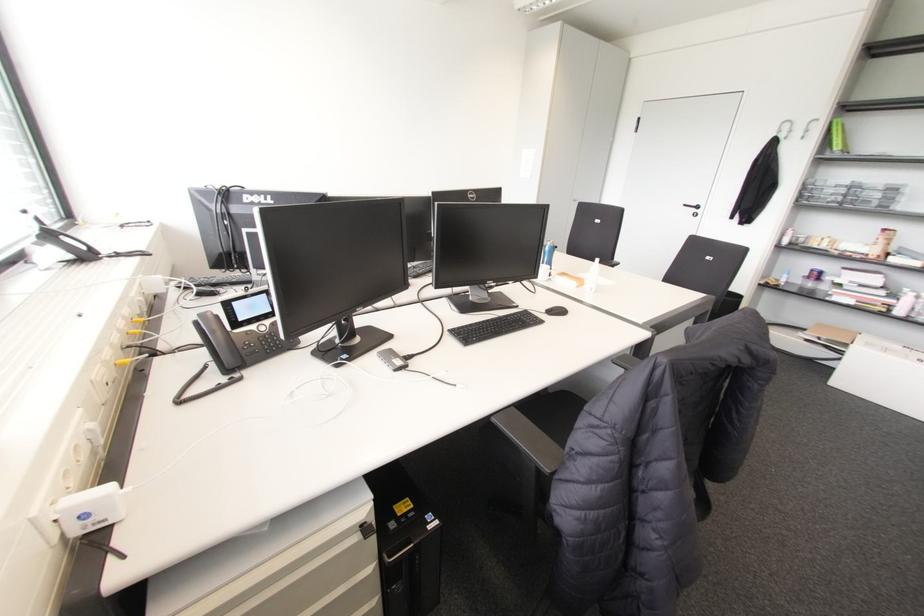
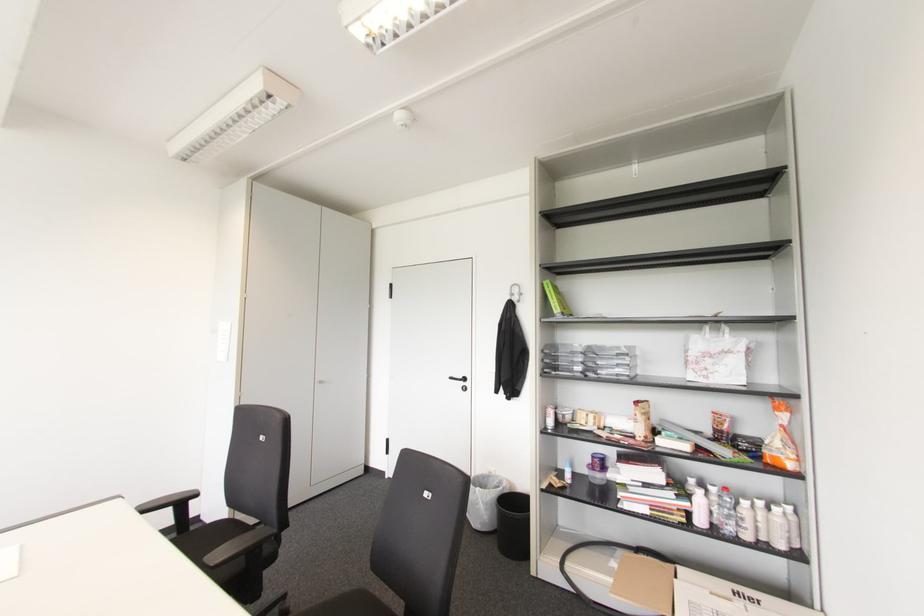
Locate, in the second image, the point that corresponds to (785,126) in the first image.

(516, 290)